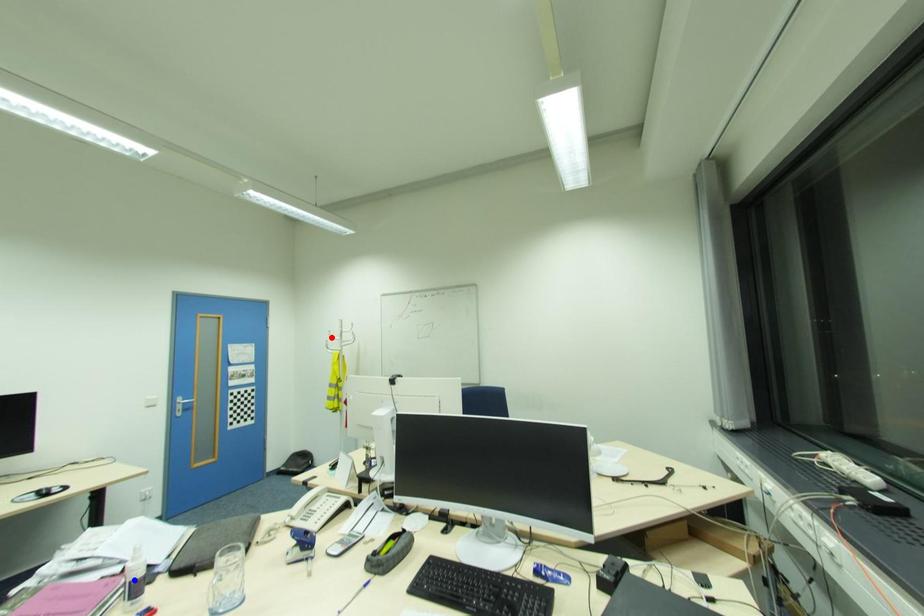
Question: Which of the two points in the image is closer to the camera?

Choices:
 (A) Blue point is closer.
 (B) Red point is closer.

Answer: (A)